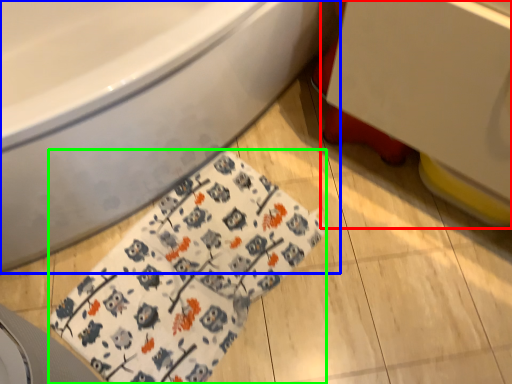
Question: Considering the real-world distances, which object is farthest from sink (highlighted by a red box)? bathtub (highlighted by a blue box) or blanket (highlighted by a green box)?

Choices:
 (A) bathtub
 (B) blanket

Answer: (B)